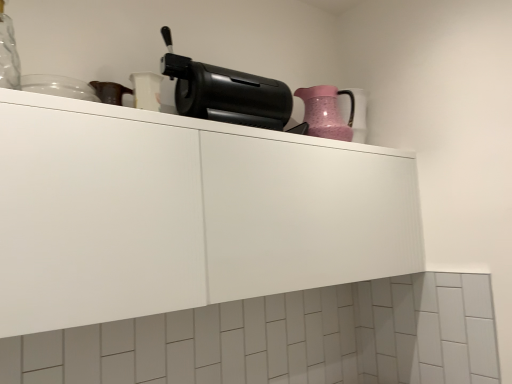
Question: Is black plastic coffee maker at upper center in front of white matte cabinet at upper center?

Choices:
 (A) yes
 (B) no

Answer: (B)

Question: Can you confirm if black plastic coffee maker at upper center is thinner than white matte cabinet at upper center?

Choices:
 (A) no
 (B) yes

Answer: (B)

Question: Is black plastic coffee maker at upper center facing away from white matte cabinet at upper center?

Choices:
 (A) no
 (B) yes

Answer: (A)

Question: Would you consider black plastic coffee maker at upper center to be distant from white matte cabinet at upper center?

Choices:
 (A) no
 (B) yes

Answer: (A)

Question: From a real-world perspective, is black plastic coffee maker at upper center physically below white matte cabinet at upper center?

Choices:
 (A) yes
 (B) no

Answer: (B)

Question: In terms of size, does black plastic coffee maker at upper center appear bigger or smaller than white matte cabinet at upper center?

Choices:
 (A) big
 (B) small

Answer: (B)

Question: From a real-world perspective, is black plastic coffee maker at upper center physically located above or below white matte cabinet at upper center?

Choices:
 (A) below
 (B) above

Answer: (B)

Question: Based on their positions, is black plastic coffee maker at upper center located to the left or right of white matte cabinet at upper center?

Choices:
 (A) right
 (B) left

Answer: (B)

Question: In terms of width, does black plastic coffee maker at upper center look wider or thinner when compared to white matte cabinet at upper center?

Choices:
 (A) wide
 (B) thin

Answer: (B)

Question: Looking at the image, does pink textured pitcher at upper right seem bigger or smaller compared to white matte cabinet at upper center?

Choices:
 (A) small
 (B) big

Answer: (A)

Question: Which is correct: pink textured pitcher at upper right is inside white matte cabinet at upper center, or outside of it?

Choices:
 (A) outside
 (B) inside

Answer: (A)

Question: Based on their positions, is pink textured pitcher at upper right located to the left or right of white matte cabinet at upper center?

Choices:
 (A) right
 (B) left

Answer: (A)

Question: Considering the positions of pink textured pitcher at upper right and white matte cabinet at upper center in the image, is pink textured pitcher at upper right wider or thinner than white matte cabinet at upper center?

Choices:
 (A) wide
 (B) thin

Answer: (B)

Question: In terms of width, does white matte cabinet at upper center look wider or thinner when compared to black plastic coffee maker at upper center?

Choices:
 (A) wide
 (B) thin

Answer: (A)

Question: Is point (194, 281) positioned closer to the camera than point (183, 94)?

Choices:
 (A) closer
 (B) farther

Answer: (A)